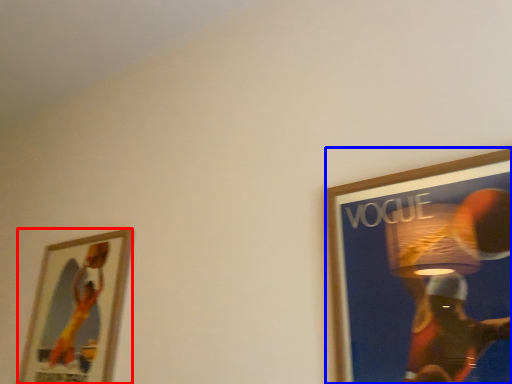
Question: Which object appears closest to the camera in this image, picture frame (highlighted by a red box) or picture frame (highlighted by a blue box)?

Choices:
 (A) picture frame
 (B) picture frame

Answer: (B)